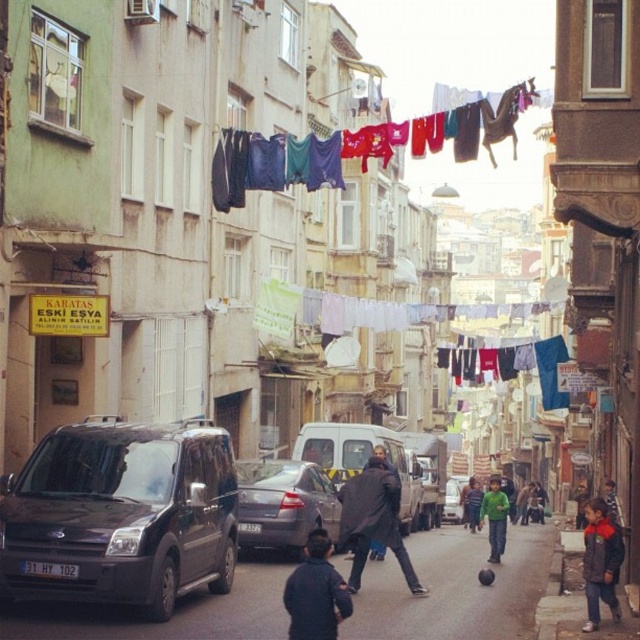
Which of these two, matte gray car at center or green cotton sweater at center, stands shorter?

green cotton sweater at center is shorter.

Locate an element on the screen. The width and height of the screenshot is (640, 640). matte gray car at center is located at coordinates (282, 502).

Where is `matte gray car at center`? Image resolution: width=640 pixels, height=640 pixels. matte gray car at center is located at coordinates (282, 502).

Is dark blue jacket at center wider than green matte shirt at center?

No, dark blue jacket at center is not wider than green matte shirt at center.

In the scene shown: Between dark blue jacket at center and green matte shirt at center, which one has more height?

Standing taller between the two is green matte shirt at center.

Where is `dark blue jacket at center`? This screenshot has width=640, height=640. dark blue jacket at center is located at coordinates (316, 593).

The image size is (640, 640). Find the location of `dark blue jacket at center`. dark blue jacket at center is located at coordinates (316, 593).

Between point (602, 499) and point (460, 492), which one is positioned behind?

Point (460, 492)

Between dark blue jacket at lower right and silver metallic van at center, which one appears on the left side from the viewer's perspective?

dark blue jacket at lower right

Does point (595, 564) come behind point (448, 509)?

No.

In order to click on dark blue jacket at lower right in this screenshot , I will do `click(600, 563)`.